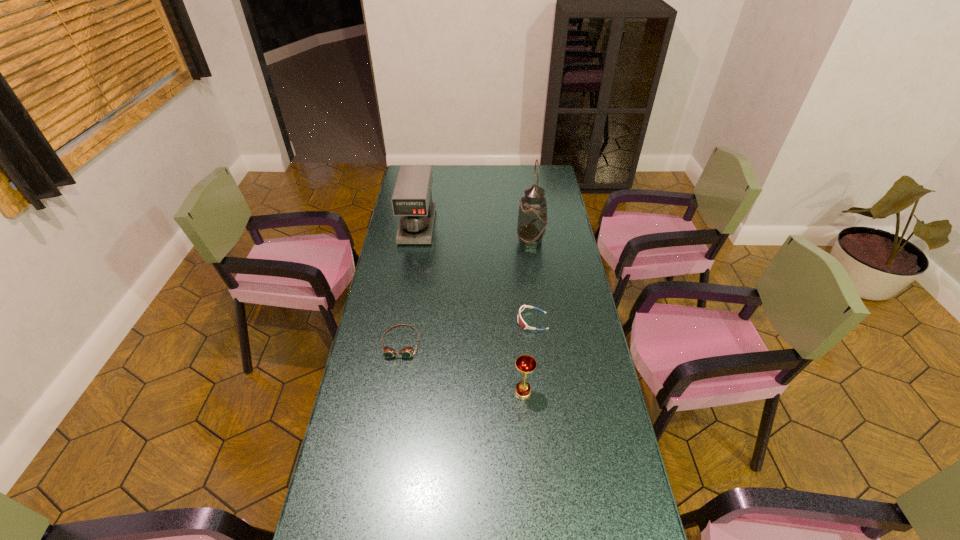
You are a GUI agent. You are given a task and a screenshot of the screen. Output one action in this format:
    pyautogui.click(x=<x>, y=<y>)
    Task: Click on the vacant area that lies between the coffee maker and the right goggles
    The width and height of the screenshot is (960, 540).
    Given the screenshot: What is the action you would take?
    pyautogui.click(x=475, y=273)

Where is `free space between the fourth shortest object and the tallest object`? Image resolution: width=960 pixels, height=540 pixels. free space between the fourth shortest object and the tallest object is located at coordinates (474, 234).

Where is `vacant space that is in between the left goggles and the nearest object`? The image size is (960, 540). vacant space that is in between the left goggles and the nearest object is located at coordinates (462, 367).

Locate an element on the screen. vacant space in between the nearest object and the oil lamp is located at coordinates (527, 316).

The image size is (960, 540). In order to click on free spot between the tallest object and the third tallest object in this screenshot , I will do `click(527, 316)`.

Identify the location of unoccupied position between the second tallest object and the third tallest object. (470, 309).

Find the location of a particular element. This screenshot has height=540, width=960. vacant area that lies between the right goggles and the second tallest object is located at coordinates (475, 273).

The width and height of the screenshot is (960, 540). Identify the location of blank region between the tallest object and the right goggles. (532, 281).

At what (x,y) coordinates should I click in order to perform the action: click on the third closest object relative to the coffee maker. Please return your answer as a coordinate pair (x, y). Image resolution: width=960 pixels, height=540 pixels. Looking at the image, I should click on (521, 322).

At what (x,y) coordinates should I click in order to perform the action: click on object identified as the third closest to the oil lamp. Please return your answer as a coordinate pair (x, y). Looking at the image, I should click on (406, 352).